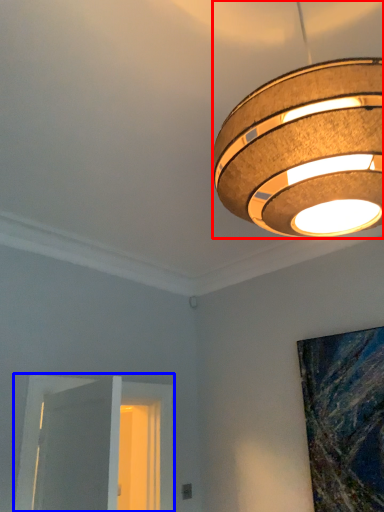
Question: Among these objects, which one is farthest to the camera, lamp (highlighted by a red box) or window (highlighted by a blue box)?

Choices:
 (A) lamp
 (B) window

Answer: (B)